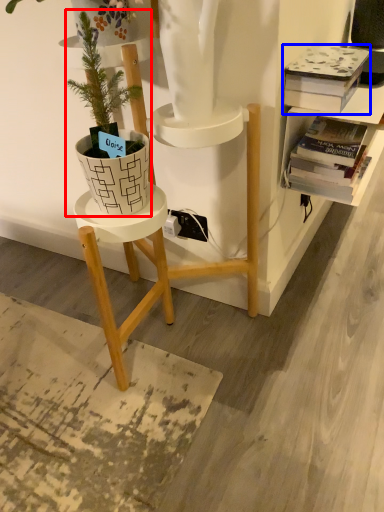
Question: Which point is closer to the camera, houseplant (highlighted by a red box) or book (highlighted by a blue box)?

Choices:
 (A) houseplant
 (B) book

Answer: (A)